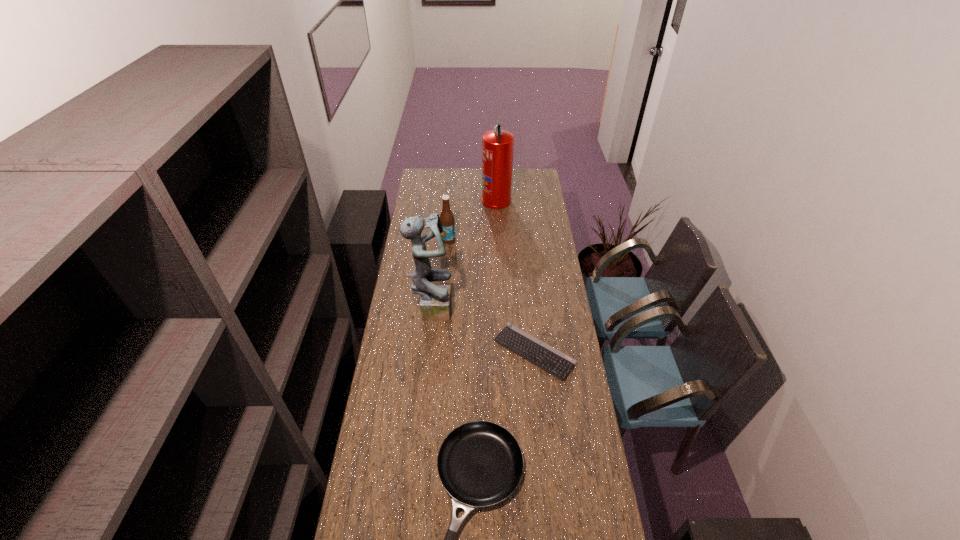
You are a GUI agent. You are given a task and a screenshot of the screen. Output one action in this format:
    pyautogui.click(x=<x>, y=<y>)
    Task: Click on the free region located 0.070m on the front of the third shortest object
    This screenshot has width=960, height=540.
    Given the screenshot: What is the action you would take?
    pyautogui.click(x=447, y=253)

I want to click on vacant space located on the front of the second nearest object, so click(x=543, y=438).

Identify the location of object positioned at the left edge. (435, 303).

Identify the location of object situated at the right edge. The width and height of the screenshot is (960, 540). (555, 362).

Image resolution: width=960 pixels, height=540 pixels. I want to click on vacant point at the left edge, so (417, 191).

This screenshot has height=540, width=960. What are the coordinates of `vacant space at the right edge of the desktop` in the screenshot? It's located at coord(545,230).

Where is `free space at the far right corner of the desktop`? free space at the far right corner of the desktop is located at coordinates (525, 181).

The height and width of the screenshot is (540, 960). I want to click on unoccupied area between the fire extinguisher and the third nearest object, so click(465, 253).

I want to click on free space between the computer keyboard and the third shortest object, so click(492, 296).

Locate an element on the screen. vacant area between the farthest object and the computer keyboard is located at coordinates (516, 276).